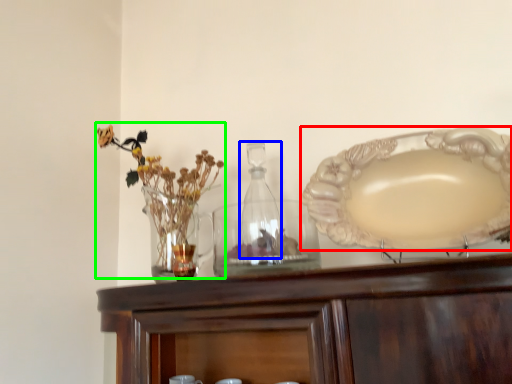
Question: Which is farther away from plate (highlighted by a red box)? bottle (highlighted by a blue box) or floral arrangement (highlighted by a green box)?

Choices:
 (A) bottle
 (B) floral arrangement

Answer: (B)